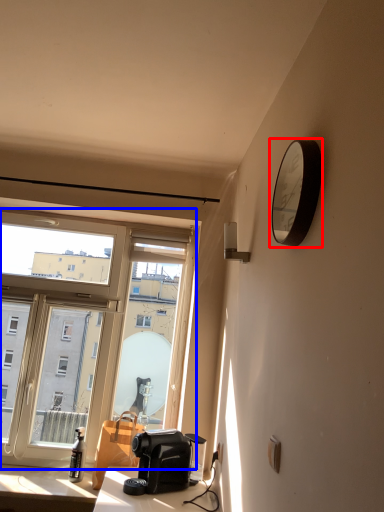
Question: Which object is closer to the camera taking this photo, clock (highlighted by a red box) or window (highlighted by a blue box)?

Choices:
 (A) clock
 (B) window

Answer: (A)